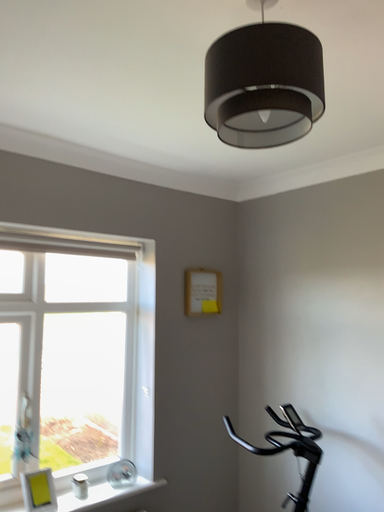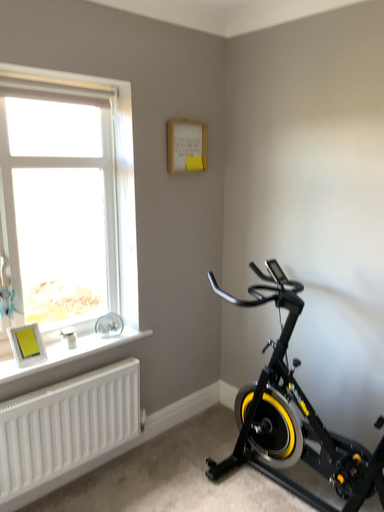
Question: How did the camera likely rotate when shooting the video?

Choices:
 (A) rotated downward
 (B) rotated upward

Answer: (A)